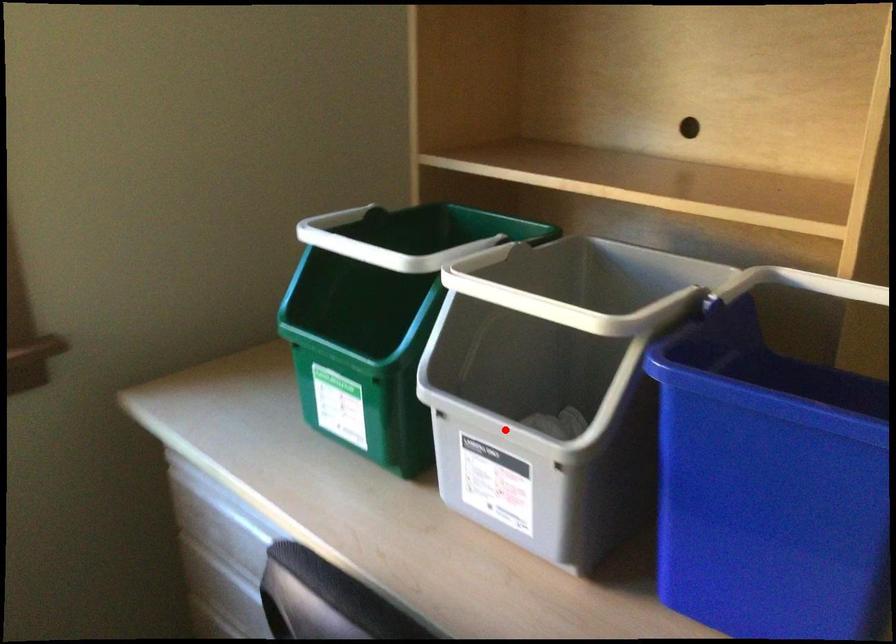
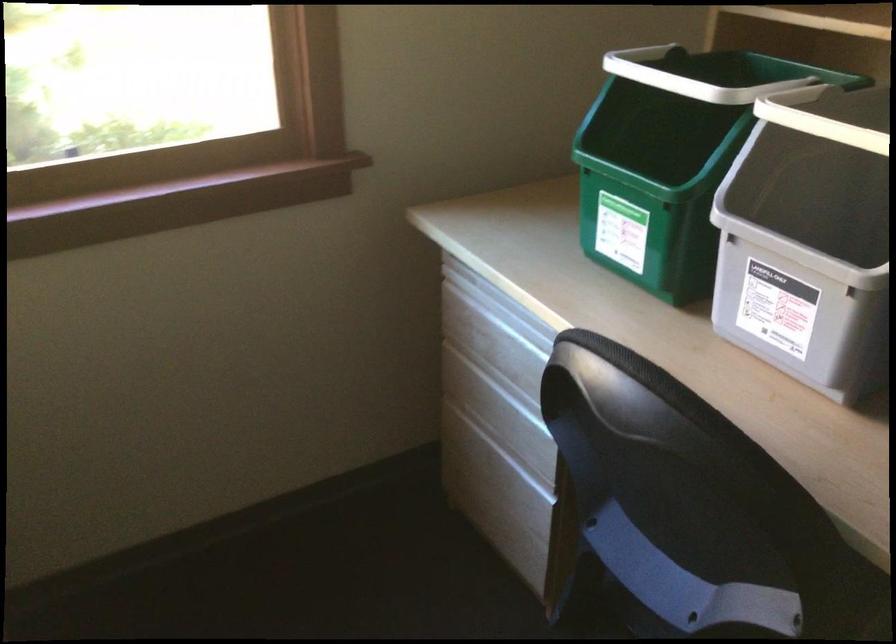
The point at the highlighted location is marked in the first image. Where is the corresponding point in the second image?

(797, 250)